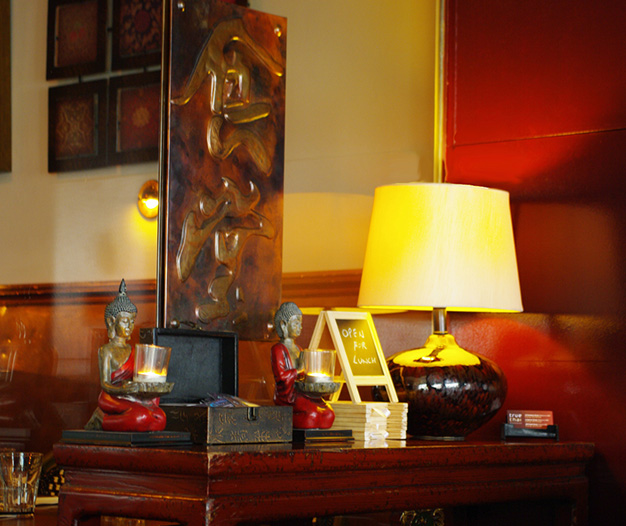
Locate an element on the screen. The image size is (626, 526). lamp shade is located at coordinates (437, 228).